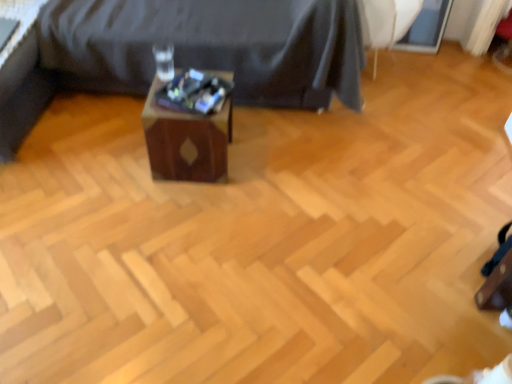
Locate an element on the screen. free space in front of wooden box at center is located at coordinates (183, 211).